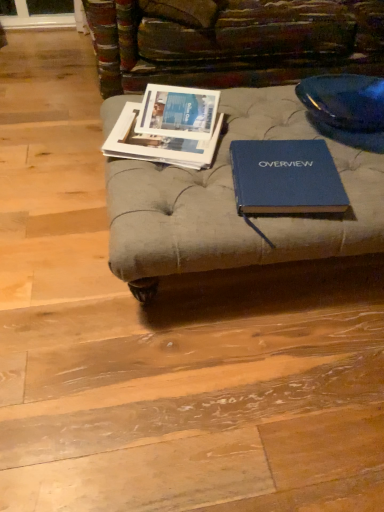
Question: Is blue hardcover book at center, which is counted as the 1th book, starting from the right, surrounding matte paper magazines at center left, the 1th book in the left-to-right sequence?

Choices:
 (A) no
 (B) yes

Answer: (A)

Question: Is blue hardcover book at center, which is counted as the 1th book, starting from the right, turned away from matte paper magazines at center left, placed as the 2th book when sorted from right to left?

Choices:
 (A) yes
 (B) no

Answer: (A)

Question: Is blue hardcover book at center, the second book viewed from the left, placed right next to matte paper magazines at center left, the 1th book in the left-to-right sequence?

Choices:
 (A) yes
 (B) no

Answer: (B)

Question: From the image's perspective, is blue hardcover book at center, the second book viewed from the left, located above matte paper magazines at center left, placed as the 2th book when sorted from right to left?

Choices:
 (A) yes
 (B) no

Answer: (B)

Question: Is blue hardcover book at center, the second book viewed from the left, further to camera compared to matte paper magazines at center left, placed as the 2th book when sorted from right to left?

Choices:
 (A) no
 (B) yes

Answer: (A)

Question: Considering the positions of point (213, 139) and point (215, 114), is point (213, 139) closer or farther from the camera than point (215, 114)?

Choices:
 (A) farther
 (B) closer

Answer: (B)

Question: From the image's perspective, relative to matte paper magazine at center, is matte paper magazines at center left, the 1th book in the left-to-right sequence, above or below?

Choices:
 (A) above
 (B) below

Answer: (B)

Question: In terms of width, does matte paper magazines at center left, the 1th book in the left-to-right sequence, look wider or thinner when compared to matte paper magazine at center?

Choices:
 (A) thin
 (B) wide

Answer: (B)

Question: In the image, is matte paper magazines at center left, placed as the 2th book when sorted from right to left, positioned in front of or behind matte paper magazine at center?

Choices:
 (A) behind
 (B) front

Answer: (B)

Question: Is blue hardcover book at center, which is counted as the 1th book, starting from the right, wider or thinner than matte paper magazines at center left, placed as the 2th book when sorted from right to left?

Choices:
 (A) thin
 (B) wide

Answer: (A)

Question: From the image's perspective, is blue hardcover book at center, which is counted as the 1th book, starting from the right, located above or below matte paper magazines at center left, placed as the 2th book when sorted from right to left?

Choices:
 (A) above
 (B) below

Answer: (B)

Question: Would you say blue hardcover book at center, the second book viewed from the left, is to the left or to the right of matte paper magazines at center left, the 1th book in the left-to-right sequence, in the picture?

Choices:
 (A) right
 (B) left

Answer: (A)

Question: Considering the positions of point (253, 140) and point (218, 124), is point (253, 140) closer or farther from the camera than point (218, 124)?

Choices:
 (A) closer
 (B) farther

Answer: (A)

Question: From a real-world perspective, relative to matte paper magazines at center left, the 1th book in the left-to-right sequence, is matte paper magazine at center vertically above or below?

Choices:
 (A) below
 (B) above

Answer: (B)

Question: Is matte paper magazine at center situated inside matte paper magazines at center left, placed as the 2th book when sorted from right to left, or outside?

Choices:
 (A) outside
 (B) inside

Answer: (A)